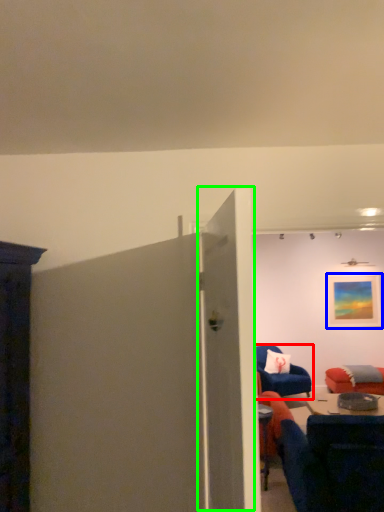
Question: Which object is the closest to the chair (highlighted by a red box)? Choose among these: picture frame (highlighted by a blue box) or door (highlighted by a green box).

Choices:
 (A) picture frame
 (B) door

Answer: (A)